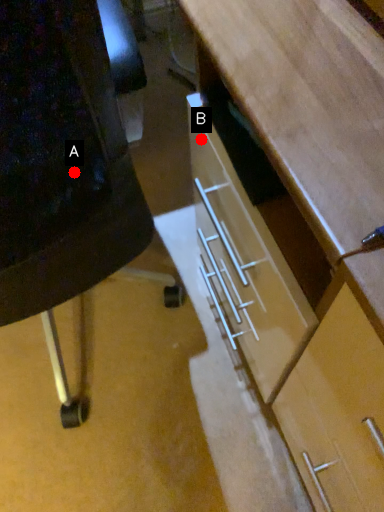
Question: Two points are circled on the image, labeled by A and B beside each circle. Among these points, which one is farthest from the camera?

Choices:
 (A) A is further
 (B) B is further

Answer: (B)